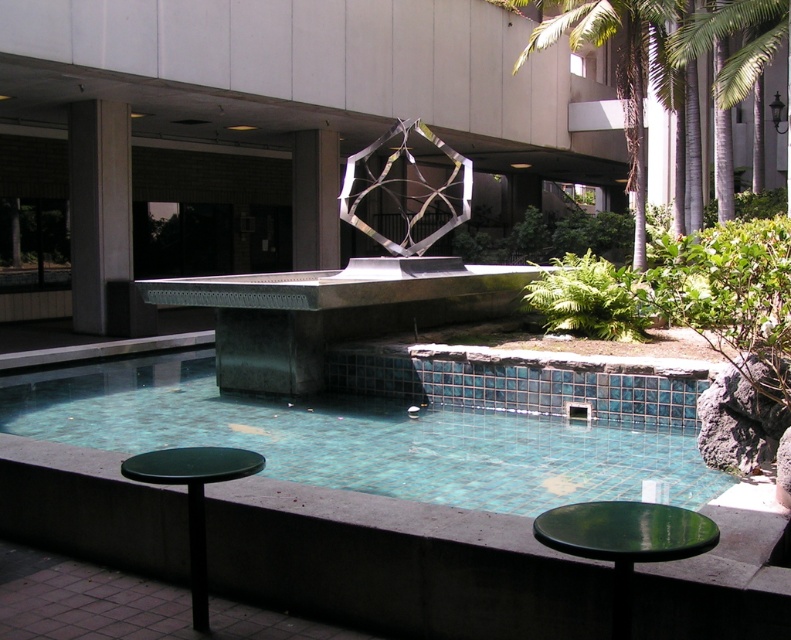
Question: Among these points, which one is farthest from the camera?

Choices:
 (A) (347, 163)
 (B) (195, 451)

Answer: (A)

Question: Considering the relative positions of dark gray concrete pillar at left and green leafy palm tree at upper center in the image provided, where is dark gray concrete pillar at left located with respect to green leafy palm tree at upper center?

Choices:
 (A) above
 (B) below

Answer: (B)

Question: Can you confirm if teal tile swimming pool at center is positioned to the right of green leafy palm tree at upper center?

Choices:
 (A) no
 (B) yes

Answer: (A)

Question: Observing the image, what is the correct spatial positioning of teal tile swimming pool at center in reference to green plastic table at lower left?

Choices:
 (A) above
 (B) below

Answer: (B)

Question: Which is nearer to the green plastic table at lower left?

Choices:
 (A) green leafy palm tree at upper center
 (B) teal tile swimming pool at center

Answer: (B)

Question: Which of the following is the farthest from the observer?

Choices:
 (A) (347, 163)
 (B) (120, 208)

Answer: (B)